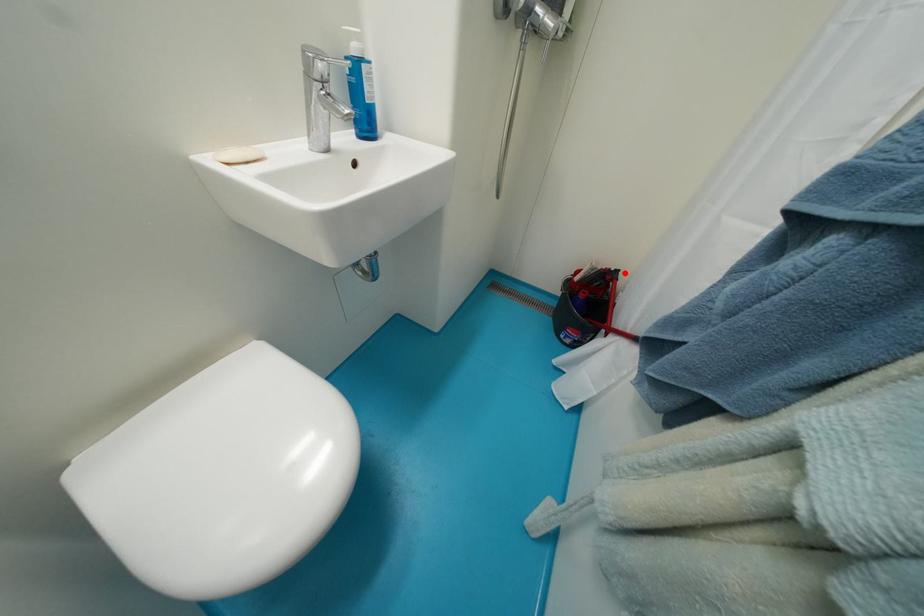
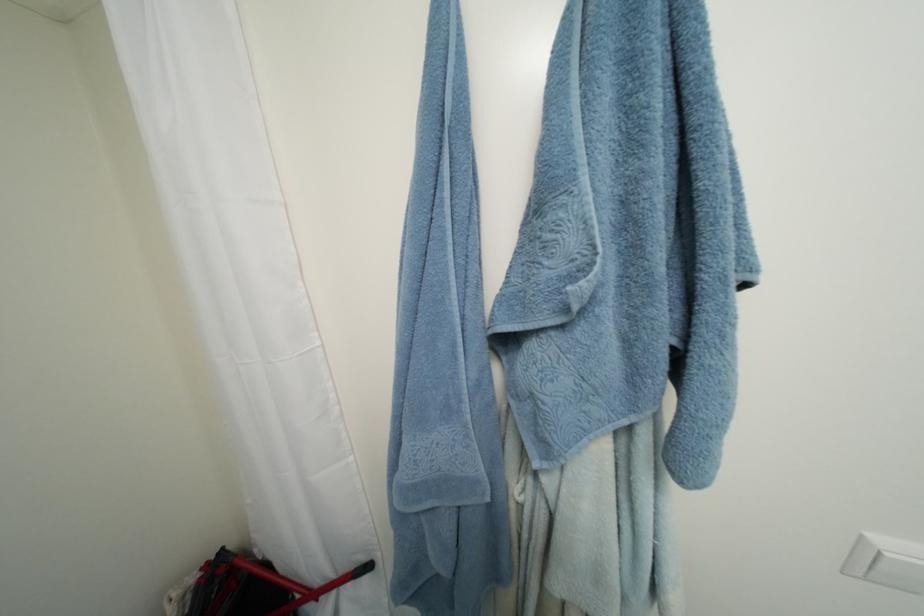
Question: I am providing you with two images of the same scene from different viewpoints. A red point is shown in image1. For the corresponding object point in image2, is it positioned nearer or farther from the camera?

Choices:
 (A) Nearer
 (B) Farther

Answer: (B)